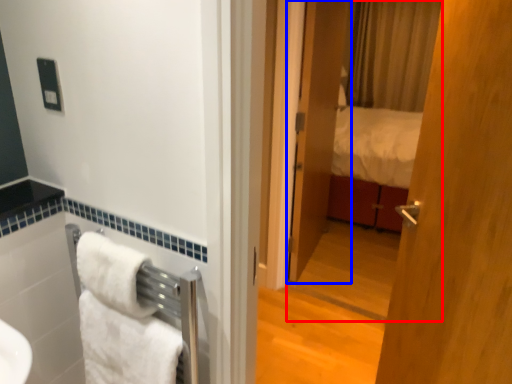
Question: Among these objects, which one is farthest to the camera, mirror (highlighted by a red box) or door (highlighted by a blue box)?

Choices:
 (A) mirror
 (B) door

Answer: (B)